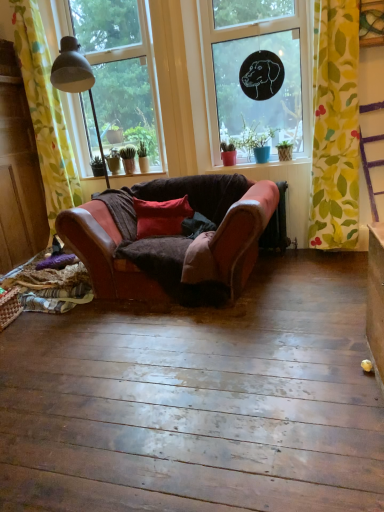
Question: From a real-world perspective, does matte red pot at center sit lower than transparent glass window at upper left, the first window positioned from the left?

Choices:
 (A) yes
 (B) no

Answer: (A)

Question: Can you confirm if matte red pot at center is taller than transparent glass window at upper left, which ranks as the 2th window in right-to-left order?

Choices:
 (A) no
 (B) yes

Answer: (A)

Question: From the image's perspective, is matte red pot at center beneath transparent glass window at upper left, which ranks as the 2th window in right-to-left order?

Choices:
 (A) no
 (B) yes

Answer: (B)

Question: Is matte red pot at center thinner than transparent glass window at upper left, the first window positioned from the left?

Choices:
 (A) yes
 (B) no

Answer: (B)

Question: Is matte red pot at center closer to camera compared to transparent glass window at upper left, which ranks as the 2th window in right-to-left order?

Choices:
 (A) yes
 (B) no

Answer: (A)

Question: Can you confirm if matte red pot at center is smaller than transparent glass window at upper left, which ranks as the 2th window in right-to-left order?

Choices:
 (A) no
 (B) yes

Answer: (B)

Question: Is leather couch at center to the right of transparent glass window at upper left, which ranks as the 2th window in right-to-left order, from the viewer's perspective?

Choices:
 (A) yes
 (B) no

Answer: (A)

Question: Is leather couch at center not inside transparent glass window at upper left, the first window positioned from the left?

Choices:
 (A) yes
 (B) no

Answer: (A)

Question: Is leather couch at center positioned before transparent glass window at upper left, which ranks as the 2th window in right-to-left order?

Choices:
 (A) no
 (B) yes

Answer: (B)

Question: From the image's perspective, does leather couch at center appear lower than transparent glass window at upper left, the first window positioned from the left?

Choices:
 (A) yes
 (B) no

Answer: (A)

Question: Is leather couch at center at the left side of transparent glass window at upper left, the first window positioned from the left?

Choices:
 (A) no
 (B) yes

Answer: (A)

Question: Is leather couch at center facing towards transparent glass window at upper left, the first window positioned from the left?

Choices:
 (A) no
 (B) yes

Answer: (A)

Question: From a real-world perspective, is green fabric at lower left positioned under transparent glass window at upper left, the first window positioned from the left, based on gravity?

Choices:
 (A) yes
 (B) no

Answer: (A)